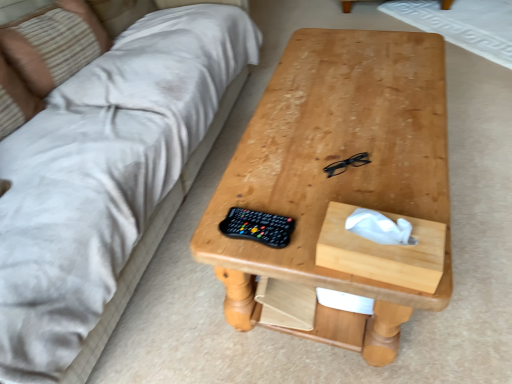
Locate an element on the screen. This screenshot has width=512, height=384. free space to the left of black plastic glasses at center is located at coordinates tap(292, 171).